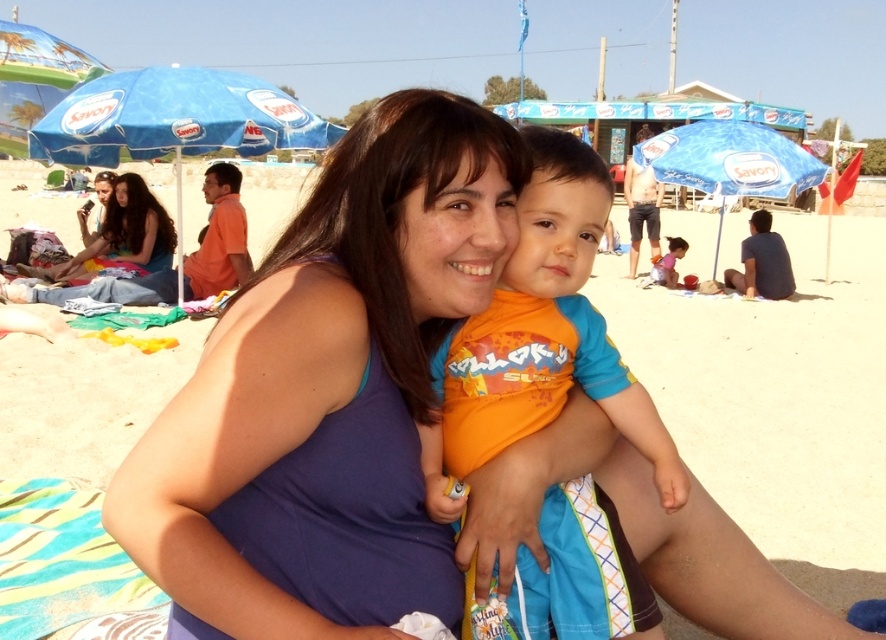
Question: Does orange fabric shirt at center have a larger size compared to long brown hair at lower left?

Choices:
 (A) no
 (B) yes

Answer: (A)

Question: Is orange fabric shirt at center positioned at the back of blue fabric umbrella at upper left?

Choices:
 (A) yes
 (B) no

Answer: (B)

Question: Which of the following is the closest to the observer?

Choices:
 (A) (556, 362)
 (B) (675, 140)

Answer: (A)

Question: Which object is farther from the camera taking this photo?

Choices:
 (A) orange cotton shirt at lower center
 (B) orange fabric shirt at center

Answer: (A)

Question: Is blue fabric umbrella at upper left wider than blue fabric umbrella at center?

Choices:
 (A) no
 (B) yes

Answer: (A)

Question: Which point is closer to the camera taking this photo?

Choices:
 (A) (677, 129)
 (B) (115, 211)
 (C) (655, 276)

Answer: (B)